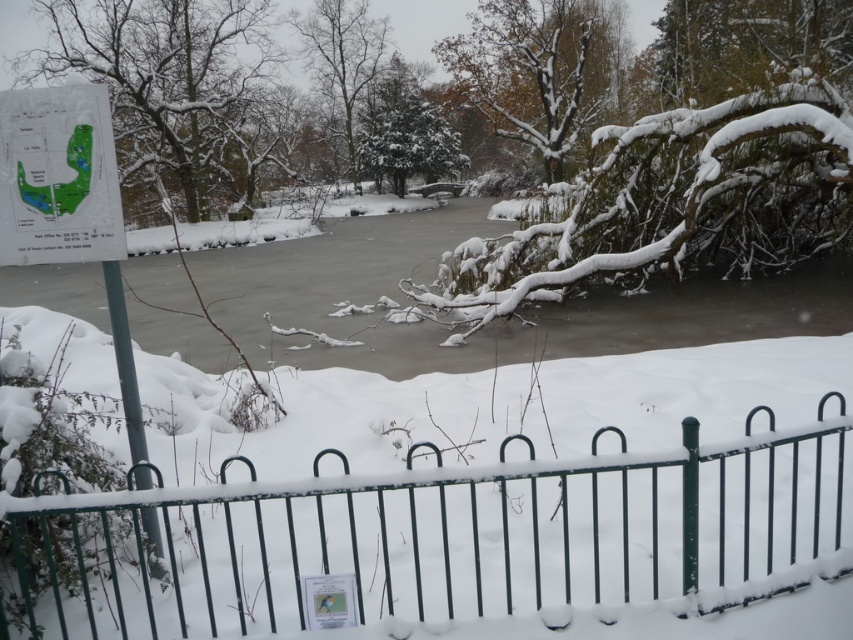
You are a hiker lost in the winter park. You see a frozen ice at center and a green paper map at upper left. Which object is closer to you?

The frozen ice at center is closer to you because the green paper map at upper left is behind it.